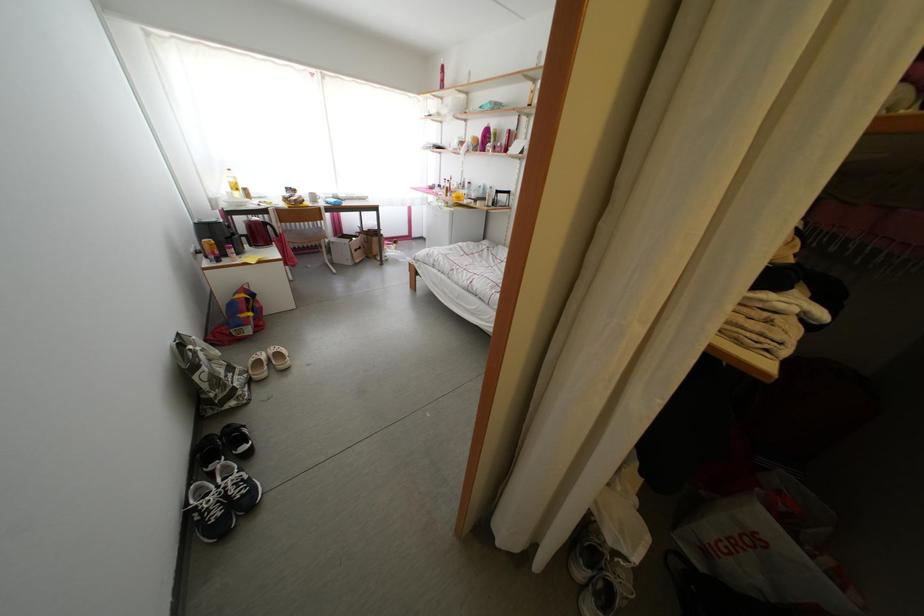
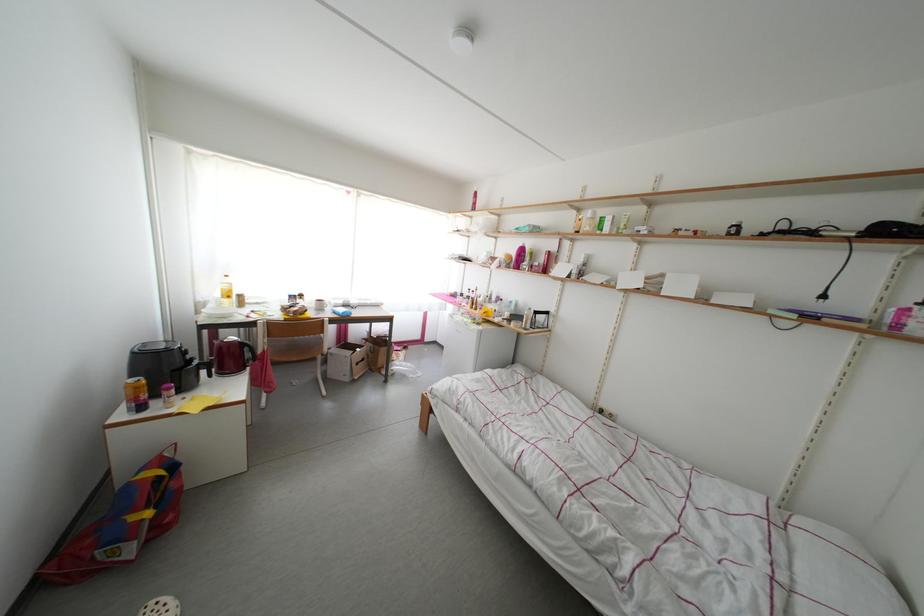
Question: Based on the continuous images, in which direction is the camera rotating? Reply with the corresponding letter.

Choices:
 (A) Left
 (B) Right
 (C) Up
 (D) Down

Answer: (C)